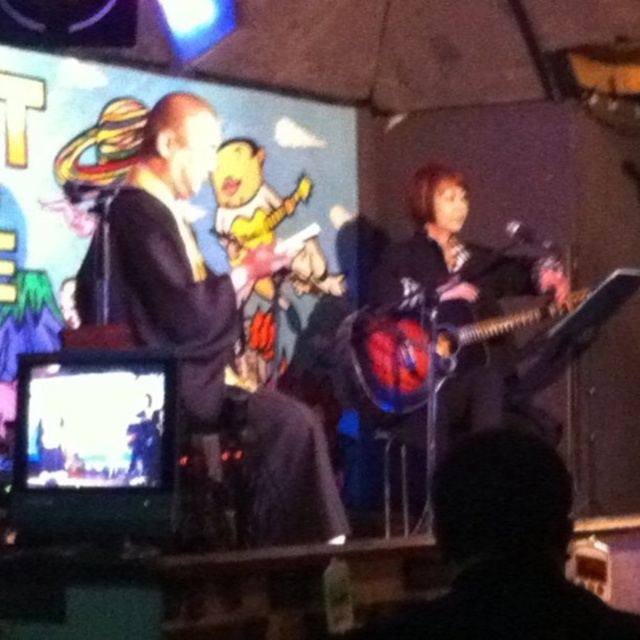
Question: Which point is closer to the camera taking this photo?

Choices:
 (A) (461, 310)
 (B) (276, 433)
 (C) (419, 307)

Answer: (B)

Question: Is black leather jacket at upper left positioned in front of shiny metallic guitar at center?

Choices:
 (A) no
 (B) yes

Answer: (B)

Question: Where is matte black guitar at center located in relation to shiny metallic guitar at center in the image?

Choices:
 (A) below
 (B) above

Answer: (B)

Question: Which object is positioned closest to the black leather jacket at upper left?

Choices:
 (A) shiny metallic guitar at center
 (B) matte black guitar at center

Answer: (A)

Question: Does black leather jacket at upper left appear on the right side of shiny metallic guitar at center?

Choices:
 (A) no
 (B) yes

Answer: (A)

Question: Which object is farther from the camera taking this photo?

Choices:
 (A) shiny metallic guitar at center
 (B) black leather jacket at upper left
 (C) matte black guitar at center

Answer: (A)